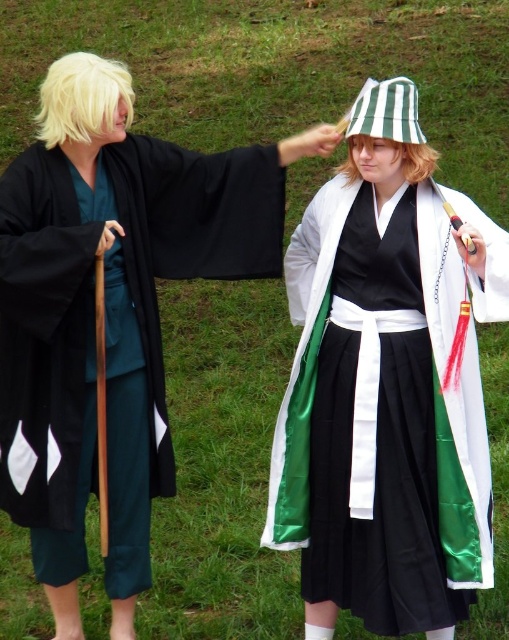
You are a photographer trying to capture a clear shot of both the black satin robe at left and the green striped fabric bucket hat at upper center. Since you want both objects to be in focus, which one should you adjust your camera focus on first?

The black satin robe at left is closer to the viewer than the green striped fabric bucket hat at upper center, so you should focus on the black satin robe at left first to ensure both are in focus.

You are a photographer planning to take a portrait of the two cosplayers. You want to ensure the green satin kimono at center is visible above the black satin robe at left in the final photo. Based on their current positions, is this possible?

The green satin kimono at center is currently located below the black satin robe at left, so adjusting their positions or angles would be necessary to make the green satin kimono at center visible above the black satin robe at left.

Looking at this image, you are a photographer trying to capture a photo of the two cosplayers. You want to ensure the black satin robe at left and the green striped fabric bucket hat at upper center are both visible in the frame. Based on their positions, which object should be placed closer to the left edge of the photo?

The black satin robe at left should be placed closer to the left edge of the photo because it is positioned to the left of the green striped fabric bucket hat at upper center.